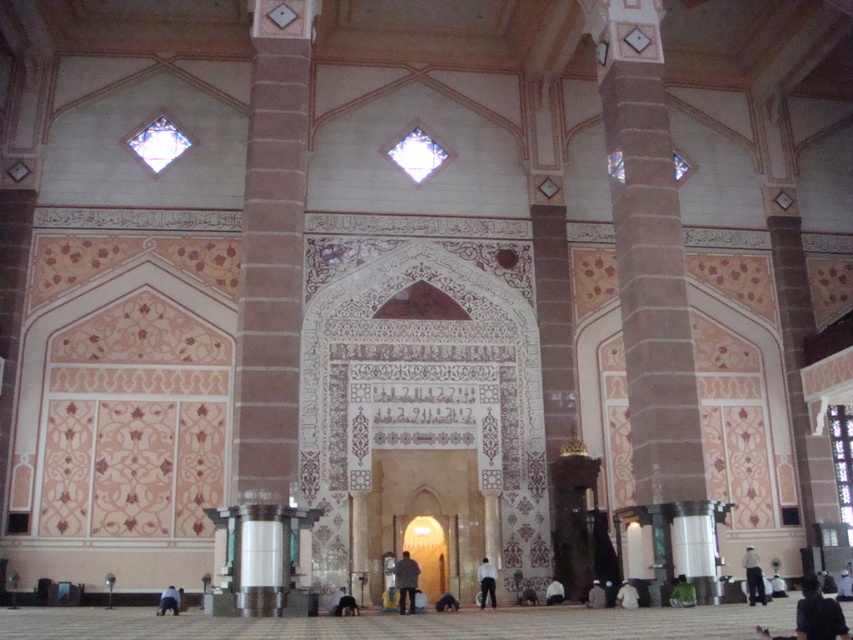
Consider the image. You are standing in the grand mosque and notice a point marked at coordinates (682, 593). Based on the scene description, what object or feature is located at this point?

The point at coordinates (682, 593) corresponds to the green fabric at lower center.

You are standing in the grand mosque and want to place a small decorative item on the green fabric at lower center. What are the coordinates where you should place it?

The coordinates for the green fabric at lower center are at point (682, 593).